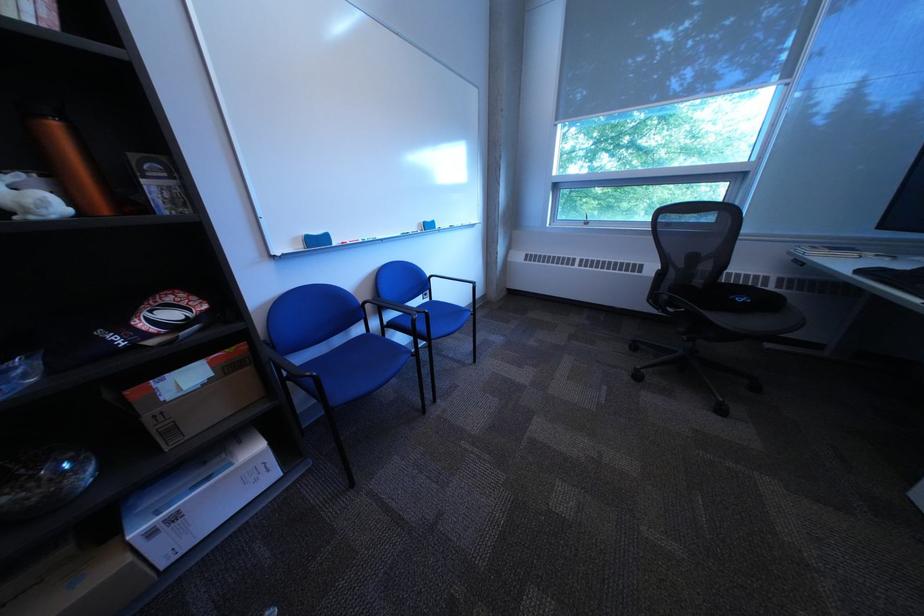
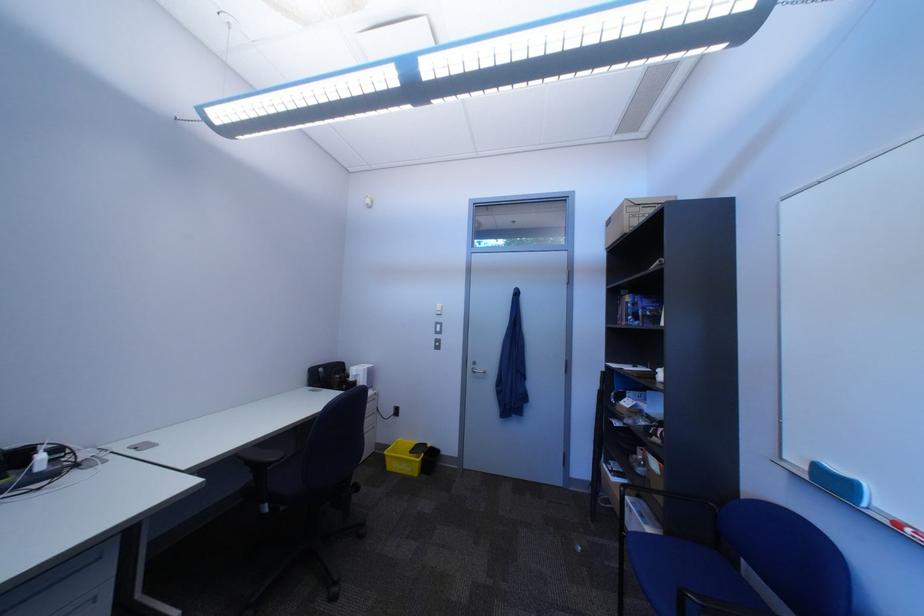
The point at (361, 244) is marked in the first image. Where is the corresponding point in the second image?

(915, 527)